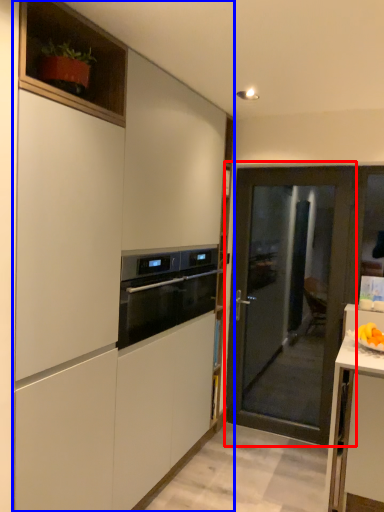
Question: Among these objects, which one is farthest to the camera, door (highlighted by a red box) or cabinetry (highlighted by a blue box)?

Choices:
 (A) door
 (B) cabinetry

Answer: (A)